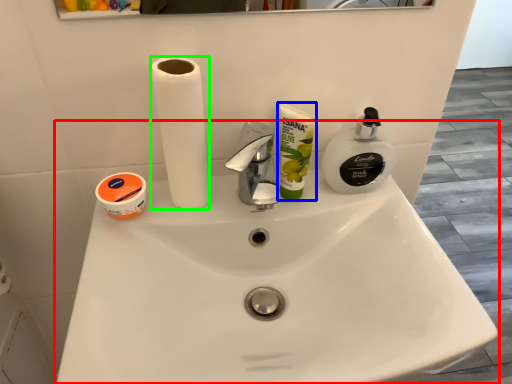
Question: Which object is positioned farthest from sink (highlighted by a red box)? Select from product (highlighted by a blue box) and paper towel (highlighted by a green box).

Choices:
 (A) product
 (B) paper towel

Answer: (B)